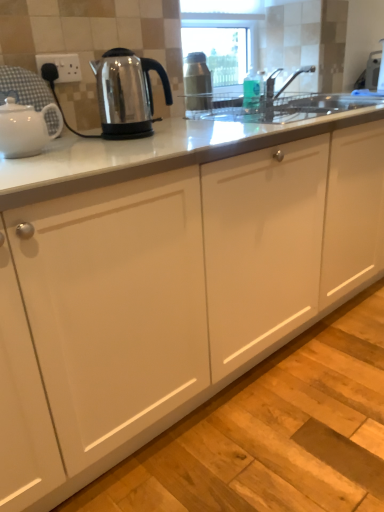
Question: Considering the relative sizes of white plastic socket at upper left and white glossy teapot at left, marked as the 2th kettle in a right-to-left arrangement, in the image provided, is white plastic socket at upper left wider than white glossy teapot at left, marked as the 2th kettle in a right-to-left arrangement,?

Choices:
 (A) no
 (B) yes

Answer: (A)

Question: Is white plastic socket at upper left not inside white glossy teapot at left, marked as the 2th kettle in a right-to-left arrangement?

Choices:
 (A) yes
 (B) no

Answer: (A)

Question: Is white plastic socket at upper left at the right side of white glossy teapot at left, marked as the 2th kettle in a right-to-left arrangement?

Choices:
 (A) yes
 (B) no

Answer: (A)

Question: Considering the relative sizes of white plastic socket at upper left and white glossy teapot at left, placed as the first kettle when sorted from left to right, in the image provided, is white plastic socket at upper left taller than white glossy teapot at left, placed as the first kettle when sorted from left to right,?

Choices:
 (A) no
 (B) yes

Answer: (A)

Question: Can you confirm if white plastic socket at upper left is positioned to the left of white glossy teapot at left, marked as the 2th kettle in a right-to-left arrangement?

Choices:
 (A) yes
 (B) no

Answer: (B)

Question: Considering their positions, is stainless steel kettle at left, positioned as the 1th kettle in right-to-left order, located in front of or behind white plastic socket at upper left?

Choices:
 (A) behind
 (B) front

Answer: (B)

Question: Based on their sizes in the image, would you say stainless steel kettle at left, the second kettle viewed from the left, is bigger or smaller than white plastic socket at upper left?

Choices:
 (A) small
 (B) big

Answer: (B)

Question: From a real-world perspective, is stainless steel kettle at left, the second kettle viewed from the left, above or below white plastic socket at upper left?

Choices:
 (A) above
 (B) below

Answer: (B)

Question: Is stainless steel kettle at left, positioned as the 1th kettle in right-to-left order, spatially inside white plastic socket at upper left, or outside of it?

Choices:
 (A) inside
 (B) outside

Answer: (B)

Question: Is white plastic socket at upper left taller or shorter than white glossy teapot at left, marked as the 2th kettle in a right-to-left arrangement?

Choices:
 (A) tall
 (B) short

Answer: (B)

Question: Would you say white plastic socket at upper left is to the left or to the right of white glossy teapot at left, placed as the first kettle when sorted from left to right, in the picture?

Choices:
 (A) right
 (B) left

Answer: (A)

Question: Which is correct: white plastic socket at upper left is inside white glossy teapot at left, placed as the first kettle when sorted from left to right, or outside of it?

Choices:
 (A) inside
 (B) outside

Answer: (B)

Question: From a real-world perspective, is white plastic socket at upper left physically located above or below white glossy teapot at left, marked as the 2th kettle in a right-to-left arrangement?

Choices:
 (A) below
 (B) above

Answer: (B)

Question: Based on their sizes in the image, would you say white glossy teapot at left, marked as the 2th kettle in a right-to-left arrangement, is bigger or smaller than stainless steel kettle at left, the second kettle viewed from the left?

Choices:
 (A) small
 (B) big

Answer: (A)

Question: Is point (44, 138) positioned closer to the camera than point (105, 135)?

Choices:
 (A) farther
 (B) closer

Answer: (B)